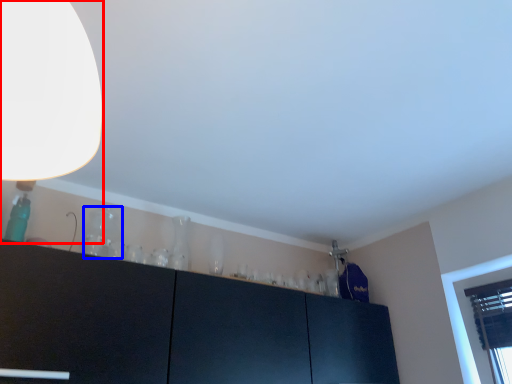
Question: Which object appears closest to the camera in this image, lamp (highlighted by a red box) or glass vase (highlighted by a blue box)?

Choices:
 (A) lamp
 (B) glass vase

Answer: (A)